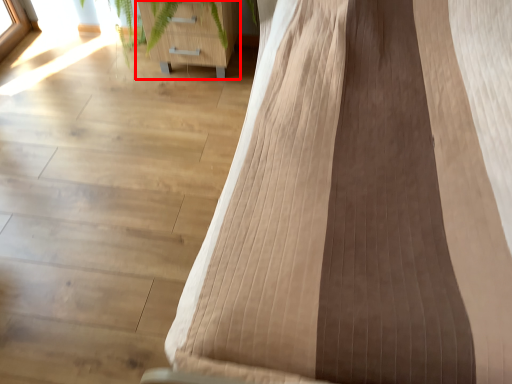
Question: From the image's perspective, what is the correct spatial relationship of furniture (annotated by the red box) in relation to furniture?

Choices:
 (A) below
 (B) above

Answer: (B)